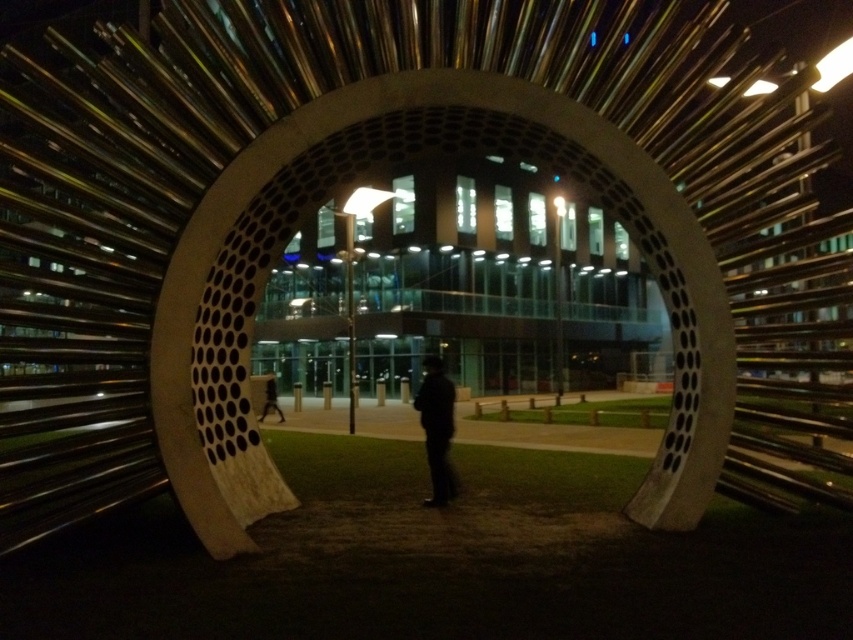
Which is more to the left, black matte jacket at center or dark clothing figure at center?

dark clothing figure at center is more to the left.

Describe the element at coordinates (436, 428) in the screenshot. I see `black matte jacket at center` at that location.

At what (x,y) coordinates should I click in order to perform the action: click on black matte jacket at center. Please return your answer as a coordinate pair (x, y). The width and height of the screenshot is (853, 640). Looking at the image, I should click on (436, 428).